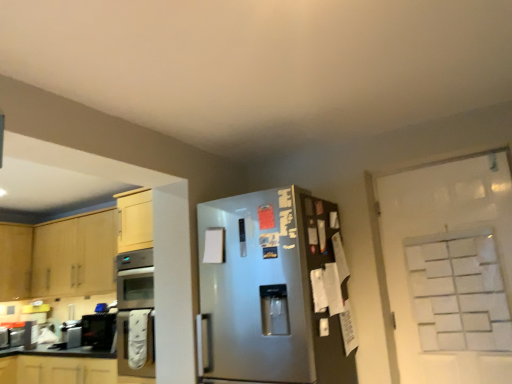
Question: Is white paperboard at right bigger than white matte glass door at upper right?

Choices:
 (A) yes
 (B) no

Answer: (A)

Question: Can you confirm if white paperboard at right is taller than white matte glass door at upper right?

Choices:
 (A) yes
 (B) no

Answer: (A)

Question: Can you confirm if white paperboard at right is positioned to the right of white matte glass door at upper right?

Choices:
 (A) yes
 (B) no

Answer: (B)

Question: From the image's perspective, would you say white paperboard at right is positioned over white matte glass door at upper right?

Choices:
 (A) no
 (B) yes

Answer: (B)

Question: From the image's perspective, is white paperboard at right below white matte glass door at upper right?

Choices:
 (A) yes
 (B) no

Answer: (B)

Question: Is white paperboard at right at the left side of white matte glass door at upper right?

Choices:
 (A) no
 (B) yes

Answer: (B)

Question: Is white matte glass door at upper right far away from satin silver refrigerator at center?

Choices:
 (A) no
 (B) yes

Answer: (A)

Question: Is white matte glass door at upper right completely or partially outside of satin silver refrigerator at center?

Choices:
 (A) no
 (B) yes

Answer: (B)

Question: Considering the relative positions of white matte glass door at upper right and satin silver refrigerator at center in the image provided, is white matte glass door at upper right to the left of satin silver refrigerator at center from the viewer's perspective?

Choices:
 (A) no
 (B) yes

Answer: (A)

Question: Can you see white matte glass door at upper right touching satin silver refrigerator at center?

Choices:
 (A) no
 (B) yes

Answer: (A)

Question: Considering the relative sizes of white matte glass door at upper right and satin silver refrigerator at center in the image provided, is white matte glass door at upper right shorter than satin silver refrigerator at center?

Choices:
 (A) yes
 (B) no

Answer: (A)

Question: From the image's perspective, is white matte glass door at upper right on top of satin silver refrigerator at center?

Choices:
 (A) yes
 (B) no

Answer: (A)

Question: Is brushed metal toaster at lower left, the 2th appliance viewed from the back, shorter than matte white cabinets at lower left, which is counted as the first cabinetry, starting from the bottom?

Choices:
 (A) no
 (B) yes

Answer: (B)